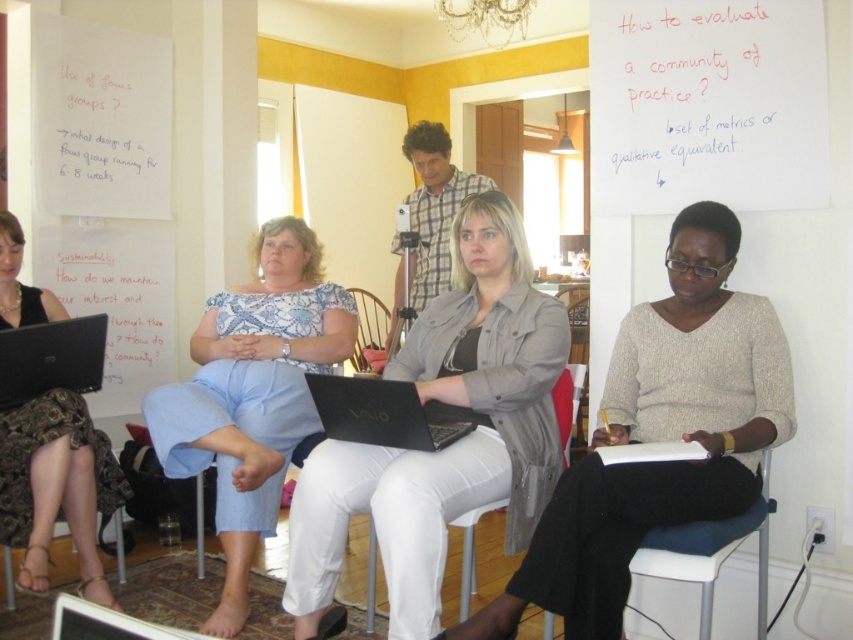
Question: Which object is closer to the camera taking this photo?

Choices:
 (A) blue cotton pants at center
 (B) wooden at center
 (C) matte black laptop at lower left
 (D) blue fabric chair at lower right

Answer: (D)

Question: Which point appears closest to the camera in this image?

Choices:
 (A) (764, 518)
 (B) (546, 637)

Answer: (A)

Question: Is matte gray jacket at center below matte black laptop at lower left?

Choices:
 (A) no
 (B) yes

Answer: (B)

Question: Which of the following is the farthest from the observer?

Choices:
 (A) (372, 408)
 (B) (463, 381)
 (C) (764, 620)

Answer: (B)

Question: Considering the relative positions of light gray fabric jacket at center and blue cotton pants at center in the image provided, where is light gray fabric jacket at center located with respect to blue cotton pants at center?

Choices:
 (A) above
 (B) below

Answer: (B)

Question: In this image, where is black matte laptop at center located relative to wooden at center?

Choices:
 (A) below
 (B) above

Answer: (A)